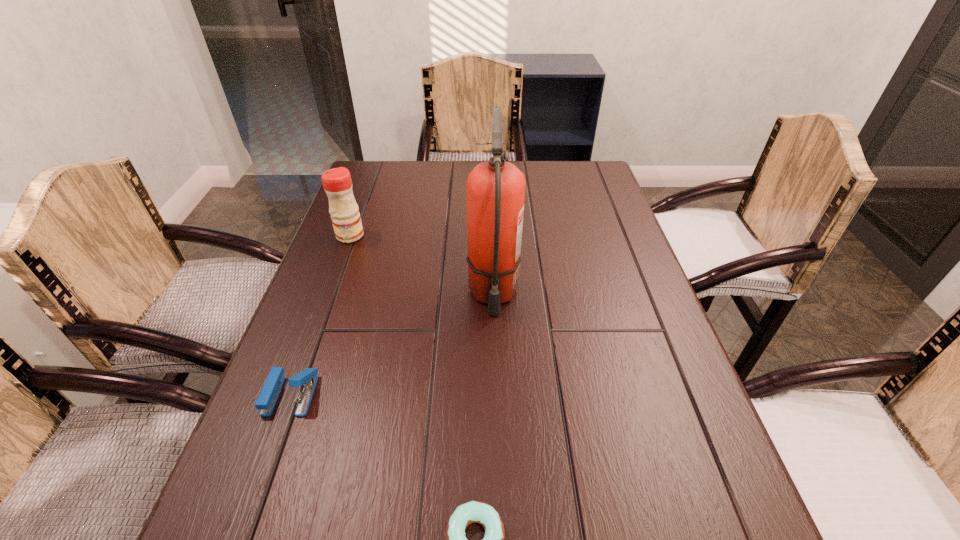
Locate an element on the screen. The height and width of the screenshot is (540, 960). stapler that is at the left edge is located at coordinates (307, 379).

Find the location of a particular element. This screenshot has width=960, height=540. free space at the far edge of the desktop is located at coordinates (434, 192).

I want to click on vacant space at the left edge of the desktop, so click(x=314, y=317).

Identify the location of free space at the right edge. (592, 226).

The height and width of the screenshot is (540, 960). Identify the location of free space at the far left corner. (405, 176).

The image size is (960, 540). Identify the location of blank region between the third farthest object and the second farthest object. (392, 345).

The width and height of the screenshot is (960, 540). Identify the location of vacant area that lies between the third nearest object and the condiment. (421, 265).

This screenshot has height=540, width=960. Find the location of `free space between the third farthest object and the farthest object`. free space between the third farthest object and the farthest object is located at coordinates (321, 315).

Image resolution: width=960 pixels, height=540 pixels. Identify the location of free spot between the third tallest object and the condiment. (321, 315).

The image size is (960, 540). In order to click on the second closest object to the doughnut in this screenshot , I will do `click(495, 189)`.